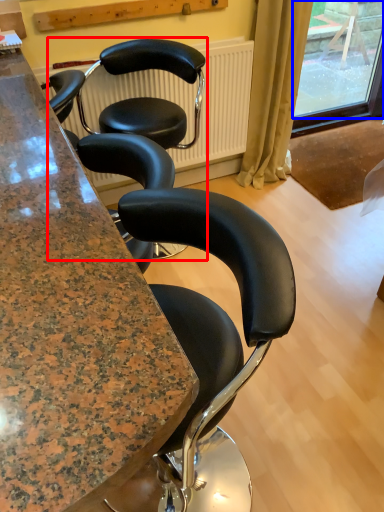
Question: Which of the following is the farthest to the observer, chair (highlighted by a red box) or window screen (highlighted by a blue box)?

Choices:
 (A) chair
 (B) window screen

Answer: (B)